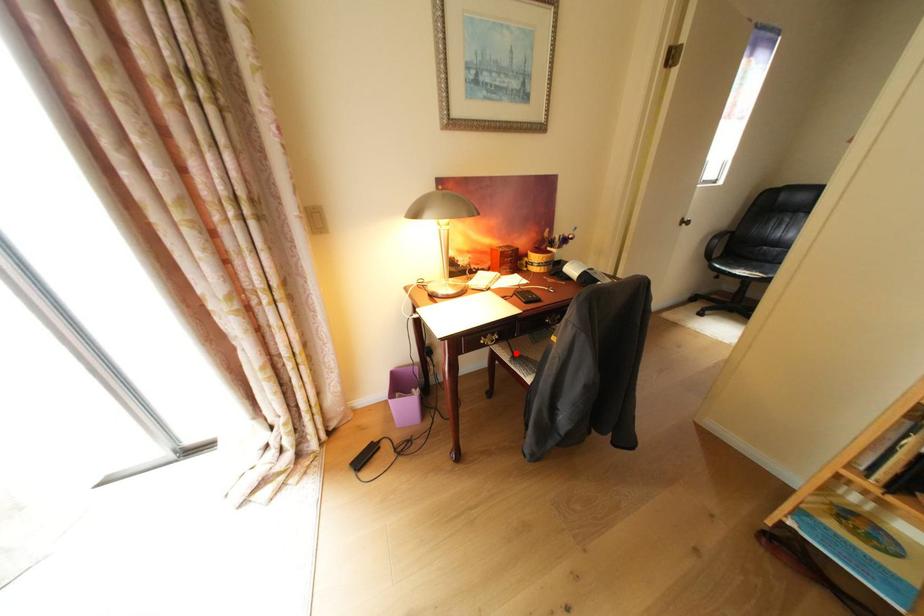
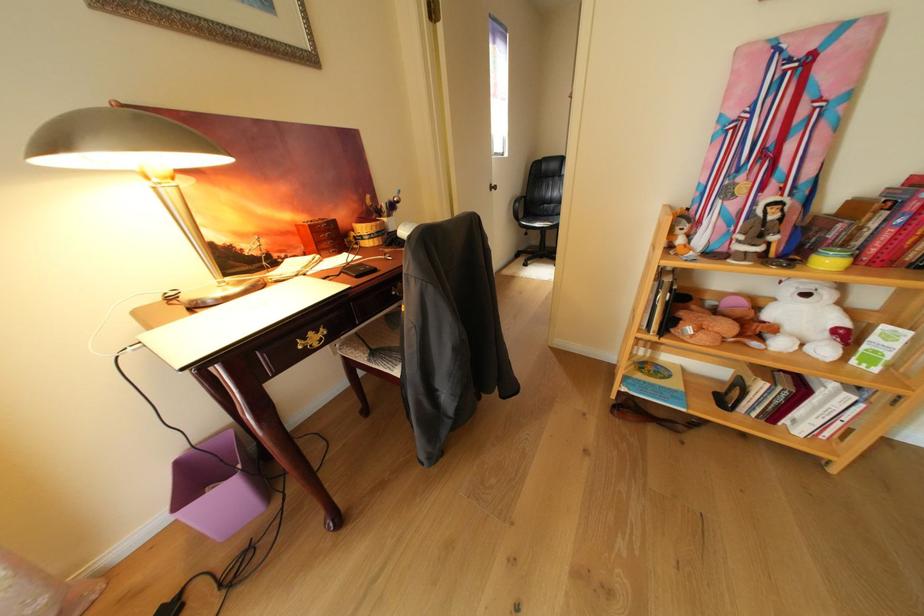
In the second image, find the point that corresponds to the highlighted location in the first image.

(371, 354)